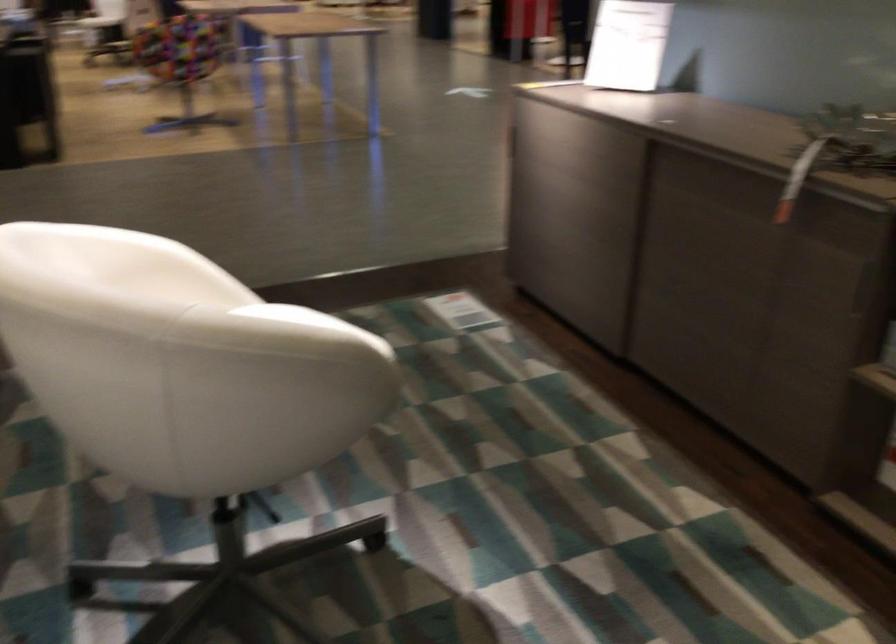
Describe the element at coordinates (45, 214) in the screenshot. The width and height of the screenshot is (896, 644). I see `the white chair armrest` at that location.